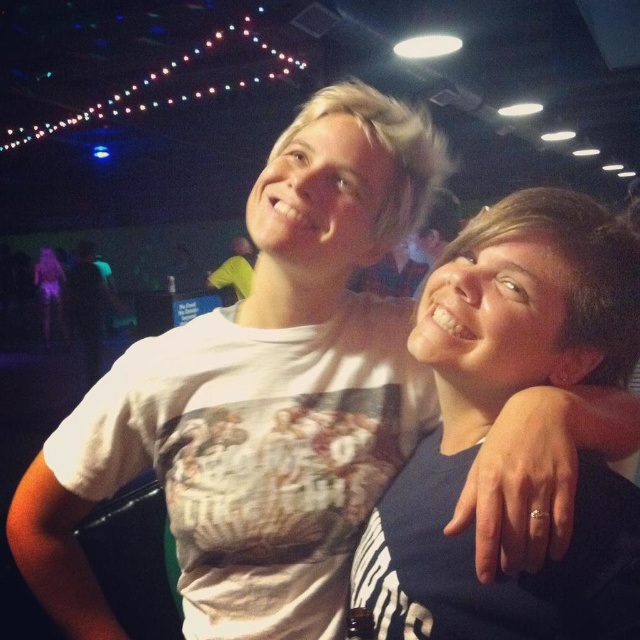
You are standing in the venue and want to locate the point at coordinates point (x=493, y=417). Which object is it on?

The point (x=493, y=417) is located on the dark blue T shirt with a white stripe design at center.